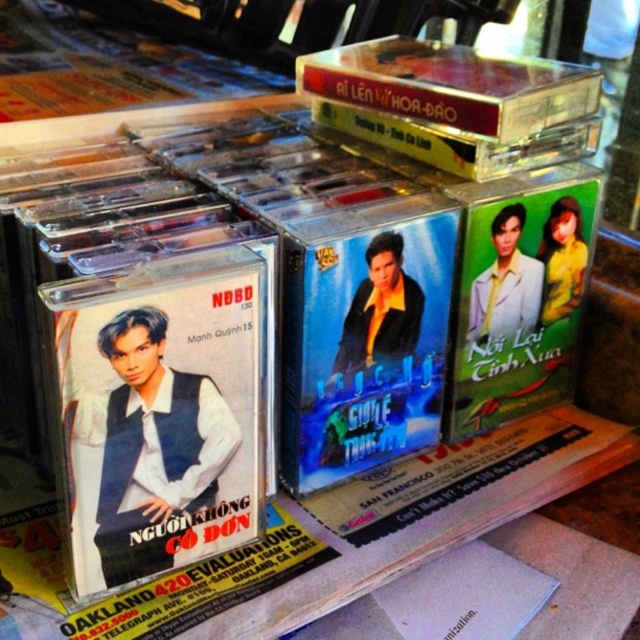
Can you confirm if matte black cassette at center is positioned to the left of green matte poster at center-right?

Indeed, matte black cassette at center is positioned on the left side of green matte poster at center-right.

In the scene shown: Is matte black cassette at center shorter than green matte poster at center-right?

Correct, matte black cassette at center is not as tall as green matte poster at center-right.

Identify the location of matte black cassette at center. The image size is (640, 640). (160, 417).

Where is `matte black cassette at center`? This screenshot has height=640, width=640. matte black cassette at center is located at coordinates (160, 417).